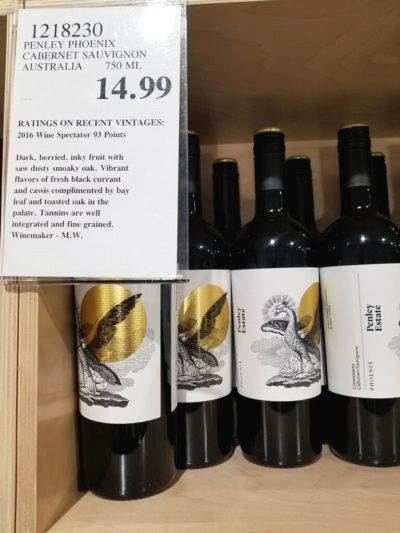
What are the coordinates of `cork` in the screenshot? It's located at (269, 127).